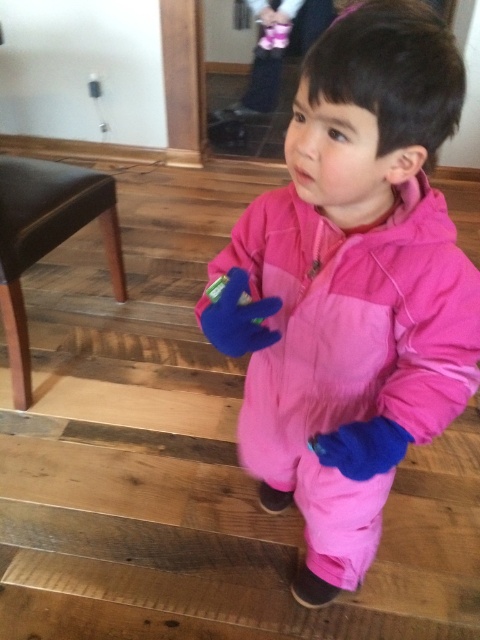
You are a tailor measuring the pink fleece snowsuit at center and the black leather stool at lower left for a custom order. Which object is wider?

The pink fleece snowsuit at center is wider than the black leather stool at lower left.

You are a photographer trying to capture a photo of the child in the scene. You notice two points marked in the image. The first point is at coordinates point (424,412) and the second is at point (56,195). Which point should you focus on to ensure the child is in sharp focus?

You should focus on point (424,412) because it is closer to the viewer than point 0.307, 0.117, ensuring the child is in sharp focus.